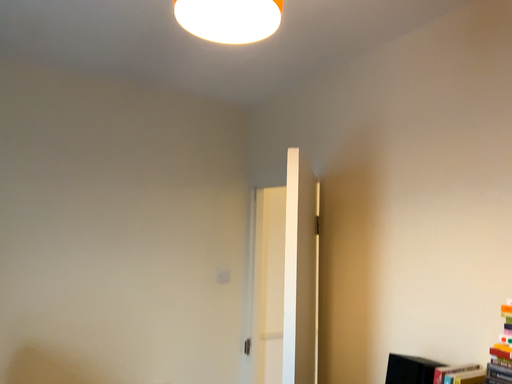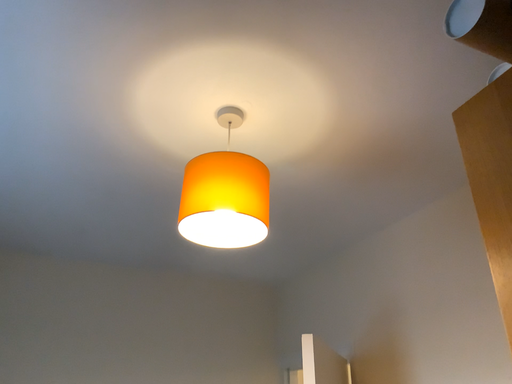
Question: Which way did the camera rotate in the video?

Choices:
 (A) rotated right
 (B) rotated left

Answer: (B)